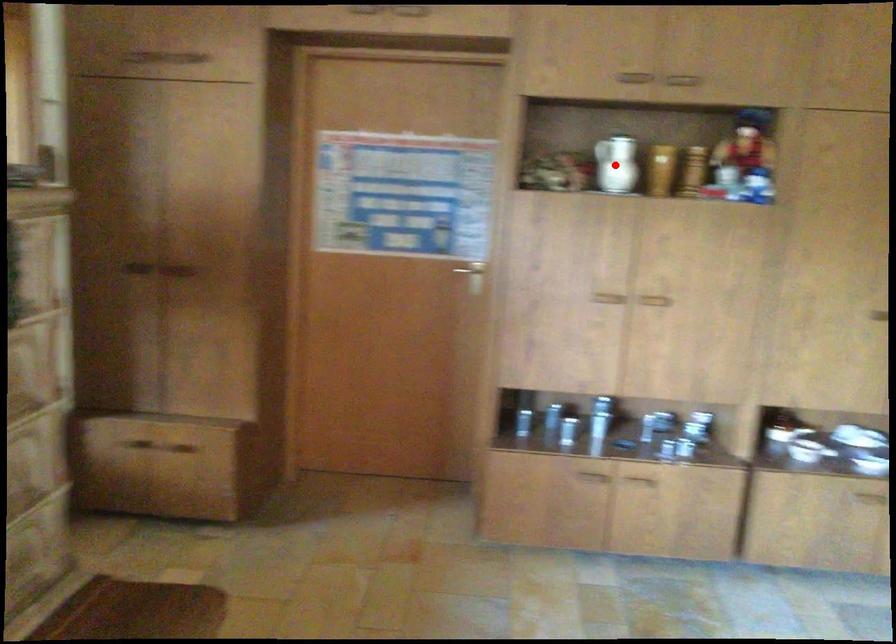
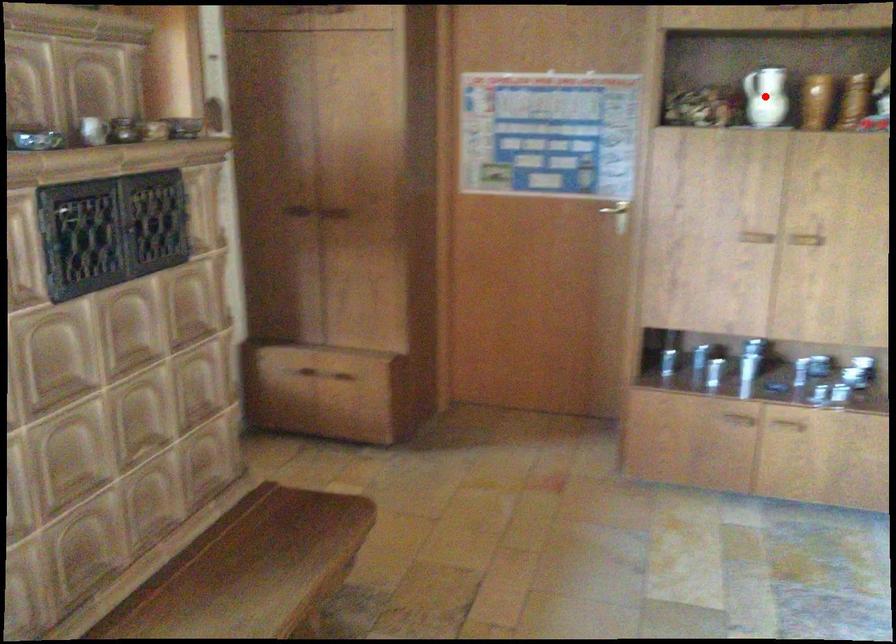
I am providing you with two images of the same scene from different viewpoints. A red point is marked on the first image and another point is marked on the second image. Is the red point in image1 aligned with the point shown in image2?

Yes